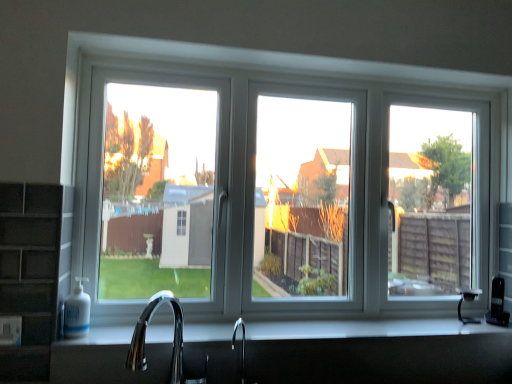
Find the location of a particular element. The width and height of the screenshot is (512, 384). white plastic window at center is located at coordinates (277, 181).

The height and width of the screenshot is (384, 512). In order to click on chrome metallic faucet at lower center in this screenshot , I will do `click(145, 335)`.

The width and height of the screenshot is (512, 384). What do you see at coordinates (365, 329) in the screenshot?
I see `white glossy countertop at center` at bounding box center [365, 329].

Locate an element on the screen. This screenshot has width=512, height=384. white plastic window at center is located at coordinates (277, 181).

Considering the relative positions of white plastic window at center and chrome metallic faucet at lower center in the image provided, is white plastic window at center in front of chrome metallic faucet at lower center?

No, white plastic window at center is further to the viewer.

From the image's perspective, which object appears higher, white plastic window at center or chrome metallic faucet at lower center?

From the image's view, white plastic window at center is above.

Which point is more distant from viewer, (298, 140) or (179, 376)?

The point (298, 140) is farther from the camera.

From the picture: Considering the sizes of objects white plastic window at center and chrome metallic faucet at lower center in the image provided, who is smaller, white plastic window at center or chrome metallic faucet at lower center?

Smaller between the two is chrome metallic faucet at lower center.

Is chrome metallic faucet at lower center wider than white plastic window at center?

Correct, the width of chrome metallic faucet at lower center exceeds that of white plastic window at center.

Does chrome metallic faucet at lower center have a lesser height compared to white plastic window at center?

Correct, chrome metallic faucet at lower center is not as tall as white plastic window at center.

Could you tell me if chrome metallic faucet at lower center is turned towards white plastic window at center?

No, chrome metallic faucet at lower center is not facing towards white plastic window at center.

How many degrees apart are the facing directions of chrome metallic faucet at lower center and white plastic window at center?

They differ by 1.31 degrees in their facing directions.

Is white glossy countertop at center in contact with white plastic window at center?

No, white glossy countertop at center is not with white plastic window at center.

Which is closer, [193,339] or [152,255]?

Point [193,339] appears to be closer to the viewer than point [152,255].

Which of these two, white glossy countertop at center or white plastic window at center, stands shorter?

Standing shorter between the two is white glossy countertop at center.

Is white glossy countertop at center at the left side of white plastic window at center?

Indeed, white glossy countertop at center is positioned on the left side of white plastic window at center.

Which of these two, chrome metallic faucet at lower center or white glossy countertop at center, is smaller?

white glossy countertop at center.

Is point (182, 374) less distant than point (84, 339)?

That is False.

Does chrome metallic faucet at lower center turn towards white glossy countertop at center?

No, chrome metallic faucet at lower center is not facing towards white glossy countertop at center.

Can white glossy countertop at center be found inside chrome metallic faucet at lower center?

No, white glossy countertop at center is not inside chrome metallic faucet at lower center.

You are a GUI agent. You are given a task and a screenshot of the screen. Output one action in this format:
    pyautogui.click(x=<x>, y=<y>)
    Task: Click on the counter top below the white plastic window at center (from the image's perspective)
    Image resolution: width=512 pixels, height=384 pixels.
    Given the screenshot: What is the action you would take?
    pyautogui.click(x=365, y=329)

Is white glossy countertop at center located within white plastic window at center?

No, white glossy countertop at center is not surrounded by white plastic window at center.

Looking at this image, is white plastic window at center smaller than white glossy countertop at center?

Actually, white plastic window at center might be larger than white glossy countertop at center.

Which object is thinner, white plastic window at center or white glossy countertop at center?

Thinner between the two is white plastic window at center.

Between white glossy countertop at center and chrome metallic faucet at lower center, which one has larger size?

chrome metallic faucet at lower center.

Do you think white glossy countertop at center is within chrome metallic faucet at lower center, or outside of it?

white glossy countertop at center cannot be found inside chrome metallic faucet at lower center.

From the image's perspective, which one is positioned higher, white glossy countertop at center or chrome metallic faucet at lower center?

chrome metallic faucet at lower center, from the image's perspective.

Considering the relative sizes of white glossy countertop at center and chrome metallic faucet at lower center in the image provided, is white glossy countertop at center wider than chrome metallic faucet at lower center?

Correct, the width of white glossy countertop at center exceeds that of chrome metallic faucet at lower center.

Identify the location of window above the chrome metallic faucet at lower center (from the image's perspective). Image resolution: width=512 pixels, height=384 pixels. (277, 181).

Where is `sink located on the left of white plastic window at center`? Image resolution: width=512 pixels, height=384 pixels. sink located on the left of white plastic window at center is located at coordinates (145, 335).

Based on their spatial positions, is chrome metallic faucet at lower center or white glossy countertop at center further from white plastic window at center?

Among the two, chrome metallic faucet at lower center is located further to white plastic window at center.

Based on their spatial positions, is white glossy countertop at center or white plastic window at center closer to chrome metallic faucet at lower center?

white glossy countertop at center is closer to chrome metallic faucet at lower center.

From the image, which object appears to be nearer to chrome metallic faucet at lower center, white plastic window at center or white glossy countertop at center?

white glossy countertop at center is positioned closer to the anchor chrome metallic faucet at lower center.

Based on their spatial positions, is chrome metallic faucet at lower center or white plastic window at center further from white glossy countertop at center?

white plastic window at center is positioned further to the anchor white glossy countertop at center.

Looking at the image, which one is located further to white glossy countertop at center, white plastic window at center or chrome metallic faucet at lower center?

white plastic window at center is further to white glossy countertop at center.

Considering their positions, is white glossy countertop at center positioned closer to white plastic window at center than chrome metallic faucet at lower center?

Based on the image, white glossy countertop at center appears to be nearer to white plastic window at center.

This screenshot has height=384, width=512. I want to click on sink that lies between white plastic window at center and white glossy countertop at center from top to bottom, so click(145, 335).